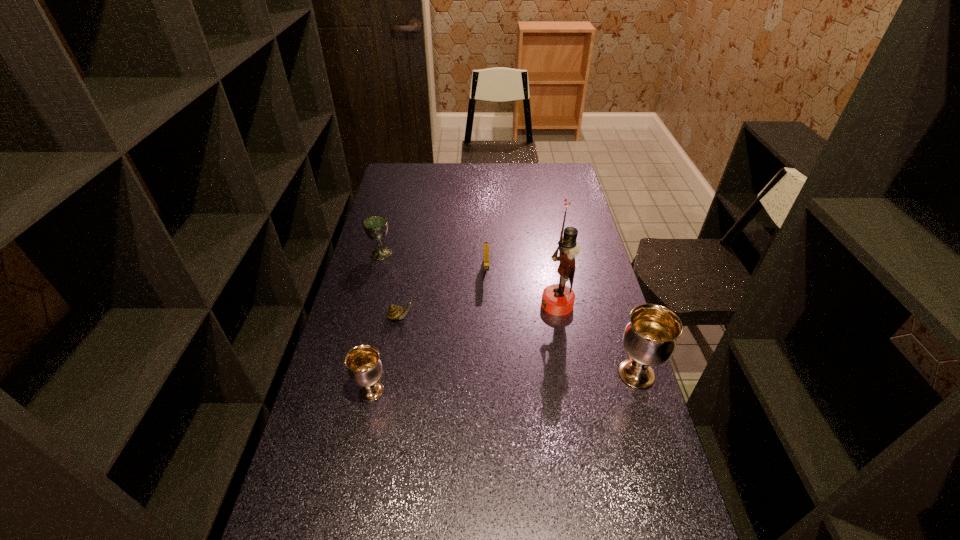
I want to click on free region located on the front-facing side of the fifth object from left to right, so coord(427,304).

Find the location of a particular element. vacant region located on the face of the snail is located at coordinates (434, 317).

Locate an element on the screen. The image size is (960, 540). vacant space situated at the barrel of the pistol is located at coordinates (487, 308).

Find the location of a particular element. The height and width of the screenshot is (540, 960). vacant area situated 0.120m on the front of the farthest chalice is located at coordinates (373, 282).

Identify the location of snail situated at the left edge. The width and height of the screenshot is (960, 540). (394, 312).

Where is `chalice situated at the right edge`? The image size is (960, 540). chalice situated at the right edge is located at coordinates (649, 339).

The width and height of the screenshot is (960, 540). Find the location of `nutcracker that is at the right edge`. nutcracker that is at the right edge is located at coordinates (557, 299).

You are a GUI agent. You are given a task and a screenshot of the screen. Output one action in this format:
    pyautogui.click(x=<x>, y=<y>)
    Task: Click on the vacant area at the far edge
    The width and height of the screenshot is (960, 540).
    Given the screenshot: What is the action you would take?
    pyautogui.click(x=504, y=169)

Locate an element on the screen. This screenshot has width=960, height=540. vacant point at the left edge is located at coordinates (322, 416).

In the image, there is a desktop. At what (x,y) coordinates should I click in order to perform the action: click on free space at the right edge. Please return your answer as a coordinate pair (x, y). Looking at the image, I should click on (574, 342).